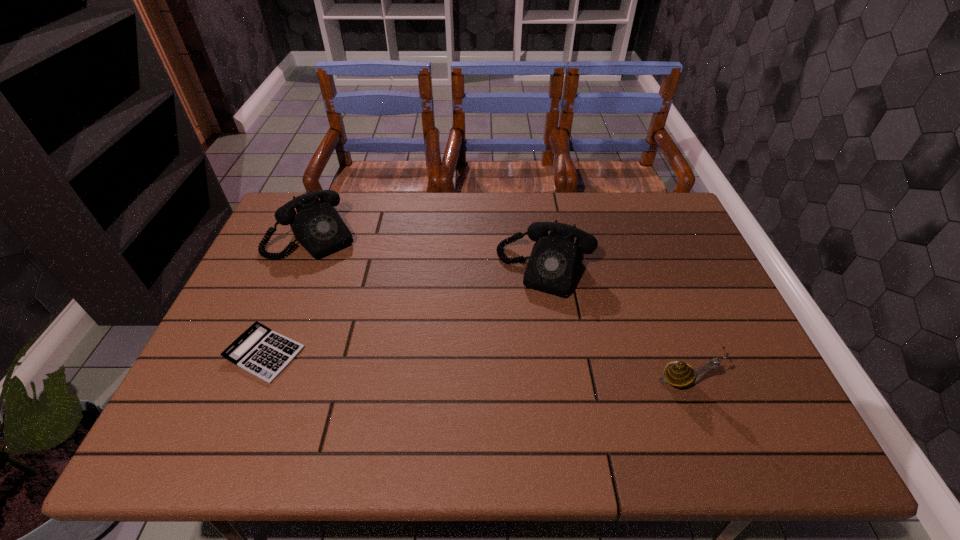
At what (x,y) coordinates should I click in order to perform the action: click on free spot that satisfies the following two spatial constraints: 1. on the front side of the calculator; 2. on the face of the rightmost object. Please return your answer as a coordinate pair (x, y). Looking at the image, I should click on (253, 380).

The width and height of the screenshot is (960, 540). I want to click on vacant region that satisfies the following two spatial constraints: 1. on the front side of the snail; 2. on the face of the left telephone, so pyautogui.click(x=252, y=380).

This screenshot has width=960, height=540. What are the coordinates of `vacant area that satisfies the following two spatial constraints: 1. on the front side of the second object from right to left; 2. on the face of the rightmost object` in the screenshot? It's located at (562, 380).